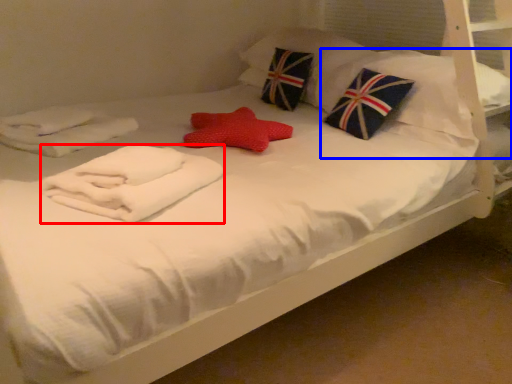
Question: Which object appears closest to the camera in this image, material (highlighted by a red box) or pillow (highlighted by a blue box)?

Choices:
 (A) material
 (B) pillow

Answer: (A)